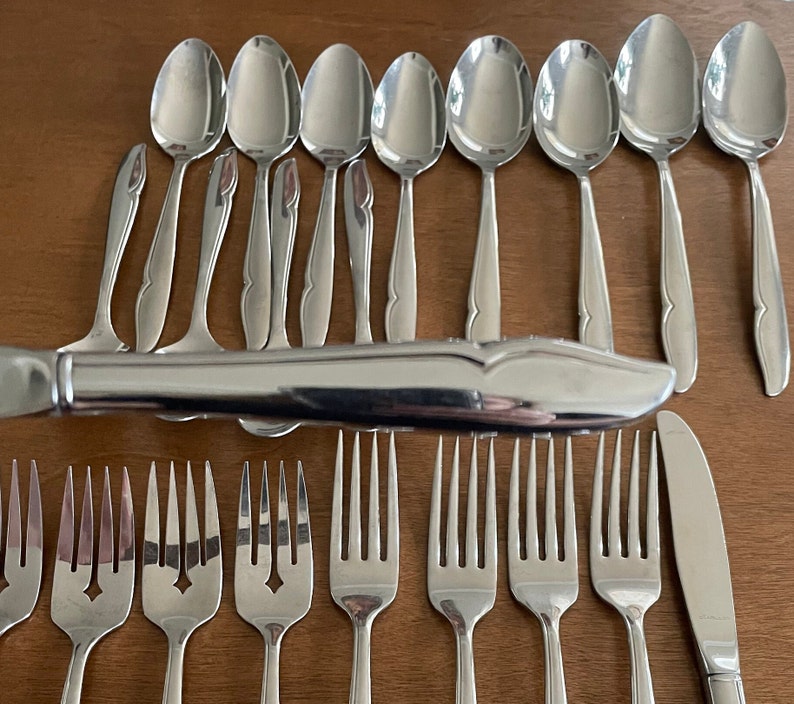
You are a GUI agent. You are given a task and a screenshot of the screen. Output one action in this format:
    pyautogui.click(x=<x>, y=<y>)
    Task: Click on the forks
    This screenshot has height=704, width=794.
    Given the screenshot: What is the action you would take?
    pyautogui.click(x=12, y=610), pyautogui.click(x=86, y=636), pyautogui.click(x=164, y=634), pyautogui.click(x=274, y=624), pyautogui.click(x=355, y=617), pyautogui.click(x=451, y=615), pyautogui.click(x=553, y=605), pyautogui.click(x=626, y=610)